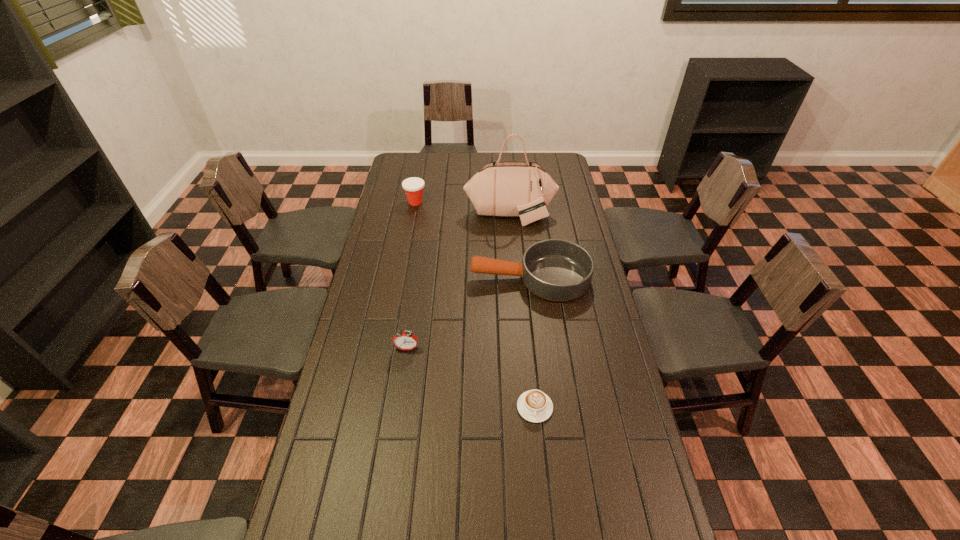
This screenshot has width=960, height=540. Identify the location of the tallest object. (524, 189).

Where is `Dixie cup`? This screenshot has height=540, width=960. Dixie cup is located at coordinates (413, 186).

Where is `pan`? The height and width of the screenshot is (540, 960). pan is located at coordinates (558, 270).

Locate an element on the screen. This screenshot has height=540, width=960. the fourth farthest object is located at coordinates (407, 340).

Where is `cappuccino`? cappuccino is located at coordinates (534, 406).

Locate an element on the screen. the nearest object is located at coordinates (534, 406).

Image resolution: width=960 pixels, height=540 pixels. What are the coordinates of `free location located on the side of the tallest object with the attached pouch` in the screenshot? It's located at (513, 251).

Where is `vacant area situated 0.340m on the front of the Dixie cup`? vacant area situated 0.340m on the front of the Dixie cup is located at coordinates (405, 257).

The height and width of the screenshot is (540, 960). I want to click on blank space located on the handle side of the third farthest object, so click(x=458, y=278).

The image size is (960, 540). Identify the location of vacant point located on the handle side of the third farthest object. (368, 278).